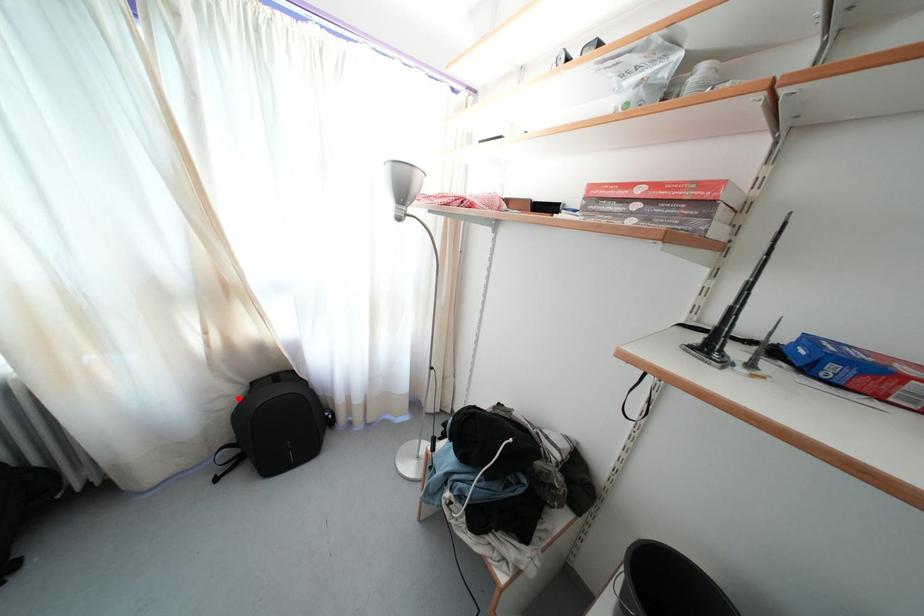
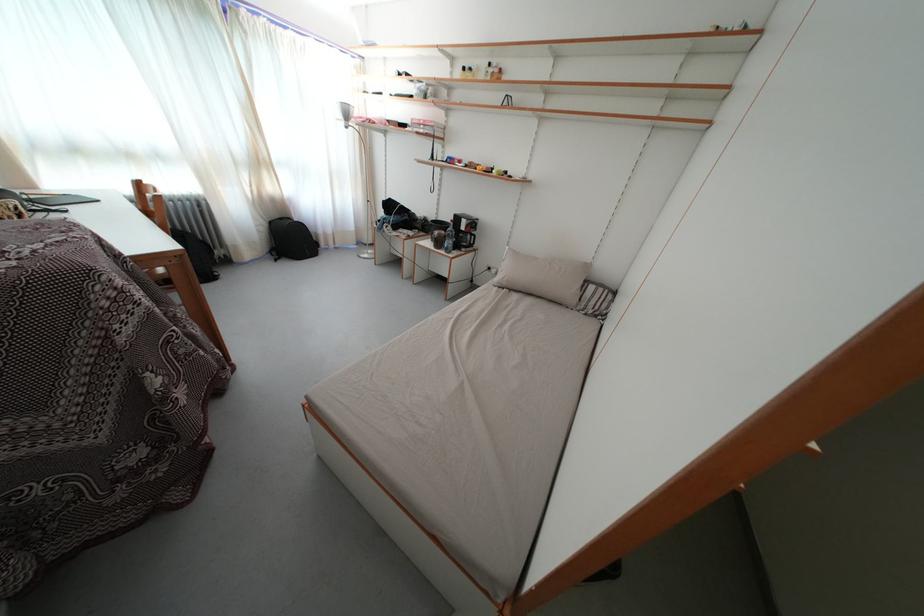
Question: I am providing you with two images of the same scene from different viewpoints. In image1, a red point is highlighted. Considering the same 3D point in image2, which of the following is correct?

Choices:
 (A) It is closer
 (B) It is farther

Answer: (A)